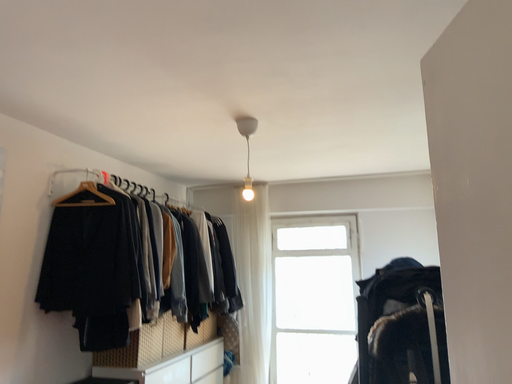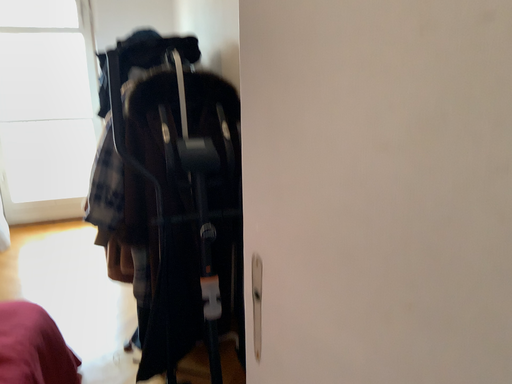
Question: Which way did the camera rotate in the video?

Choices:
 (A) rotated left
 (B) rotated right

Answer: (B)